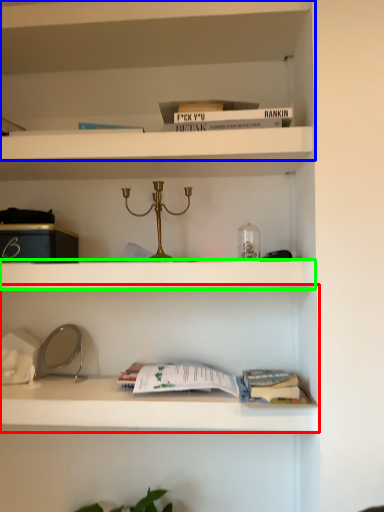
Question: Based on their relative distances, which object is farther from shelf (highlighted by a red box)? Choose from shelf (highlighted by a blue box) and cabinet (highlighted by a green box).

Choices:
 (A) shelf
 (B) cabinet

Answer: (A)